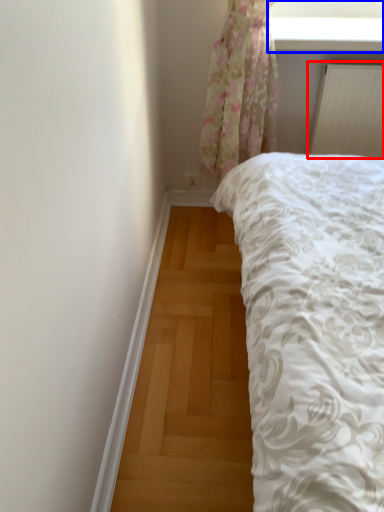
Question: Which of the following is the closest to the observer, radiator (highlighted by a red box) or window screen (highlighted by a blue box)?

Choices:
 (A) radiator
 (B) window screen

Answer: (B)